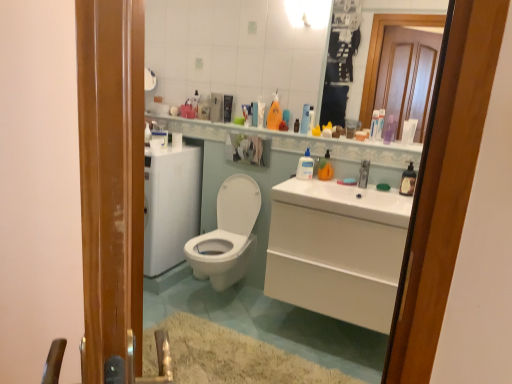
Question: From the image's perspective, would you say clear glass mirror at upper center is positioned over translucent plastic soap dispenser at upper center, the 4th toiletry viewed from the right?

Choices:
 (A) no
 (B) yes

Answer: (B)

Question: Is clear glass mirror at upper center in front of translucent plastic soap dispenser at upper center, the 4th toiletry viewed from the right?

Choices:
 (A) no
 (B) yes

Answer: (B)

Question: Could you tell me if clear glass mirror at upper center is turned towards translucent plastic soap dispenser at upper center, acting as the 5th toiletry starting from the left?

Choices:
 (A) yes
 (B) no

Answer: (A)

Question: Can you confirm if clear glass mirror at upper center is positioned to the left of translucent plastic soap dispenser at upper center, acting as the 5th toiletry starting from the left?

Choices:
 (A) yes
 (B) no

Answer: (B)

Question: Is clear glass mirror at upper center next to translucent plastic soap dispenser at upper center, acting as the 5th toiletry starting from the left?

Choices:
 (A) yes
 (B) no

Answer: (B)

Question: From the image's perspective, is translucent plastic soap dispenser at upper center, the 4th toiletry viewed from the right, above or below orange matte bottle at upper center, which appears as the second cleaning product when viewed from the right?

Choices:
 (A) above
 (B) below

Answer: (A)

Question: Is point (349, 120) closer or farther from the camera than point (325, 177)?

Choices:
 (A) farther
 (B) closer

Answer: (A)

Question: Is translucent plastic soap dispenser at upper center, the 4th toiletry viewed from the right, inside the boundaries of orange matte bottle at upper center, which appears as the second cleaning product when viewed from the right, or outside?

Choices:
 (A) inside
 (B) outside

Answer: (B)

Question: Is translucent plastic soap dispenser at upper center, the 4th toiletry viewed from the right, in front of or behind orange matte bottle at upper center, the third cleaning product in the left-to-right sequence, in the image?

Choices:
 (A) front
 (B) behind

Answer: (B)

Question: Is matte plastic bottle at upper center, which ranks as the eighth toiletry in right-to-left order, inside the boundaries of clear plastic bottle at upper center, the fourth toiletry viewed from the left, or outside?

Choices:
 (A) inside
 (B) outside

Answer: (B)

Question: Is matte plastic bottle at upper center, which ranks as the eighth toiletry in right-to-left order, to the left or to the right of clear plastic bottle at upper center, arranged as the fifth toiletry when viewed from the right, in the image?

Choices:
 (A) right
 (B) left

Answer: (B)

Question: Is matte plastic bottle at upper center, marked as the 1th toiletry in a left-to-right arrangement, bigger or smaller than clear plastic bottle at upper center, arranged as the fifth toiletry when viewed from the right?

Choices:
 (A) small
 (B) big

Answer: (A)

Question: From the image's perspective, is matte plastic bottle at upper center, which ranks as the eighth toiletry in right-to-left order, positioned above or below clear plastic bottle at upper center, arranged as the fifth toiletry when viewed from the right?

Choices:
 (A) below
 (B) above

Answer: (B)

Question: In terms of height, does white glossy toilet at center look taller or shorter compared to matte plastic bottle at upper center, which ranks as the eighth toiletry in right-to-left order?

Choices:
 (A) tall
 (B) short

Answer: (A)

Question: Considering their positions, is white glossy toilet at center located in front of or behind matte plastic bottle at upper center, marked as the 1th toiletry in a left-to-right arrangement?

Choices:
 (A) front
 (B) behind

Answer: (A)